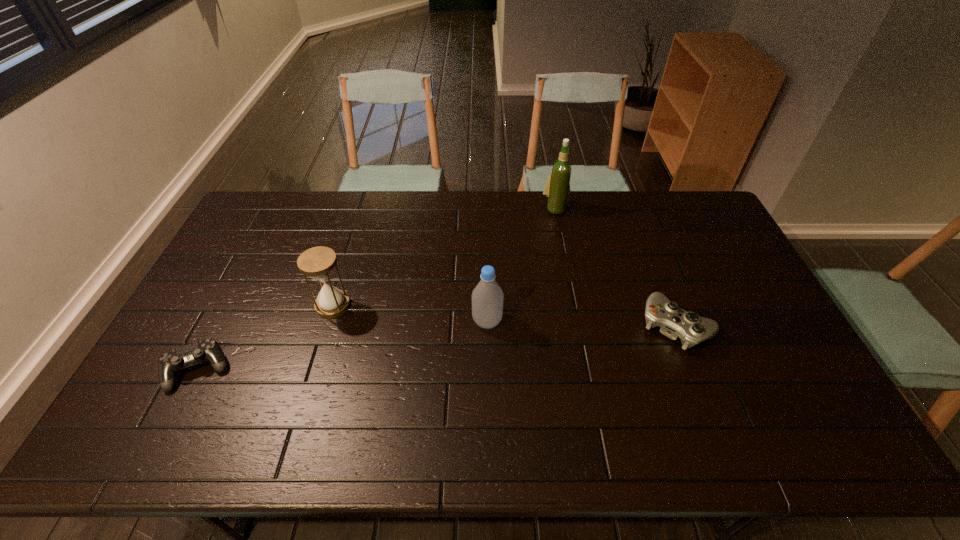
Where is `vacant space that is in between the second shortest object and the bottle`? vacant space that is in between the second shortest object and the bottle is located at coordinates (582, 323).

Identify which object is the closest to the tallest object. Please provide its 2D coordinates. Your answer should be formatted as a tuple, i.e. [(x, y)], where the tuple contains the x and y coordinates of a point satisfying the conditions above.

[(675, 322)]

Identify which object is the second nearest to the shortest object. Please provide its 2D coordinates. Your answer should be formatted as a tuple, i.e. [(x, y)], where the tuple contains the x and y coordinates of a point satisfying the conditions above.

[(487, 297)]

The height and width of the screenshot is (540, 960). In order to click on free space that satisfies the following two spatial constraints: 1. on the back side of the hourglass; 2. on the left side of the shortest object in this screenshot , I will do pyautogui.click(x=231, y=305).

You are a GUI agent. You are given a task and a screenshot of the screen. Output one action in this format:
    pyautogui.click(x=<x>, y=<y>)
    Task: Click on the free location that satisfies the following two spatial constraints: 1. on the front side of the fourth tallest object; 2. on the left side of the third object from left to right
    The height and width of the screenshot is (540, 960).
    Given the screenshot: What is the action you would take?
    pyautogui.click(x=488, y=326)